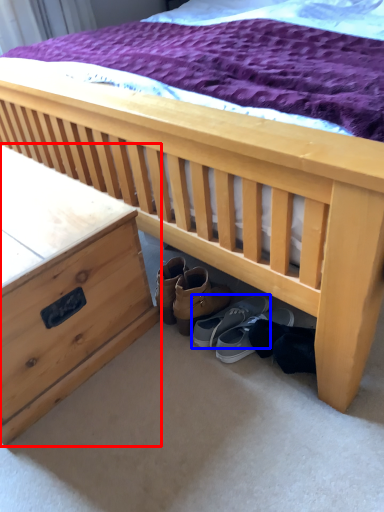
Question: Among these objects, which one is nearest to the camera, nightstand (highlighted by a red box) or footwear (highlighted by a blue box)?

Choices:
 (A) nightstand
 (B) footwear

Answer: (A)